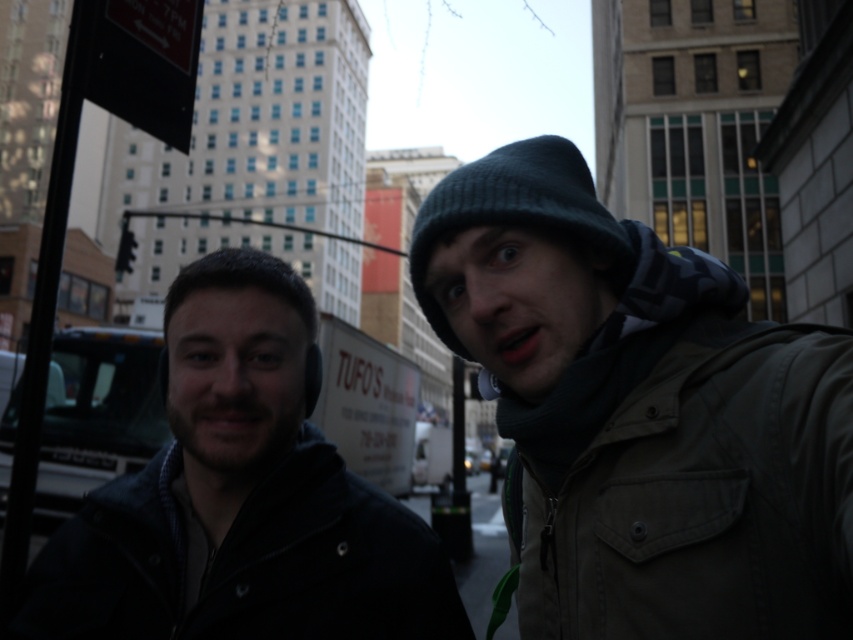
Question: In this image, where is dark blue jacket at center located relative to black knit hat at upper right?

Choices:
 (A) below
 (B) above

Answer: (A)

Question: Which point appears farthest from the camera in this image?

Choices:
 (A) (473, 202)
 (B) (579, 156)

Answer: (B)

Question: Is dark blue jacket at center thinner than black knit hat at upper right?

Choices:
 (A) no
 (B) yes

Answer: (A)

Question: Estimate the real-world distances between objects in this image. Which object is closer to the dark blue jacket at center?

Choices:
 (A) black knit hat at upper right
 (B) knit cap at upper right

Answer: (B)

Question: Which of the following is the closest to the observer?

Choices:
 (A) (314, 612)
 (B) (454, 340)

Answer: (A)

Question: Is knit cap at upper right to the right of black knit hat at upper right from the viewer's perspective?

Choices:
 (A) no
 (B) yes

Answer: (B)